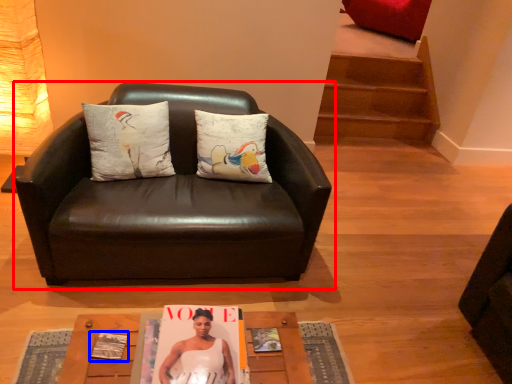
Question: Which of the following is the closest to the observer, chair (highlighted by a red box) or magazine (highlighted by a blue box)?

Choices:
 (A) chair
 (B) magazine

Answer: (B)